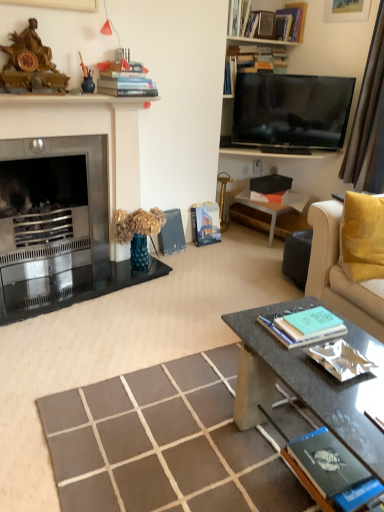
Locate an element on the screen. The height and width of the screenshot is (512, 384). blank space situated above brown textured rug at center (from a real-world perspective) is located at coordinates (178, 433).